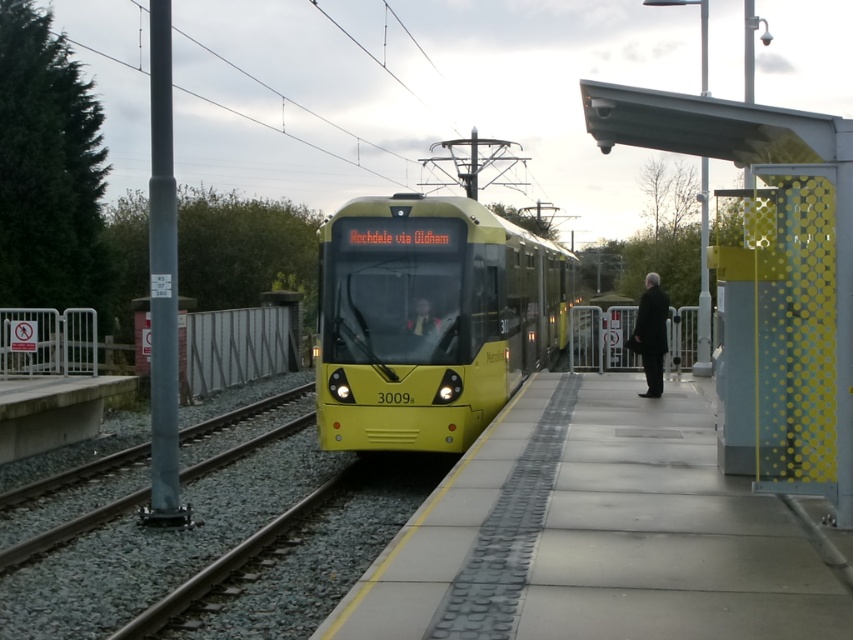
The height and width of the screenshot is (640, 853). I want to click on smooth concrete platform at center, so click(x=595, y=532).

Can you confirm if smooth concrete platform at center is positioned below yellow metallic train at center?

Correct, smooth concrete platform at center is located below yellow metallic train at center.

I want to click on smooth concrete platform at center, so click(x=595, y=532).

Identify the location of smooth concrete platform at center. This screenshot has width=853, height=640. (595, 532).

Is yellow metallic train at center below black wool coat at right?

Incorrect, yellow metallic train at center is not positioned below black wool coat at right.

From the picture: Does yellow metallic train at center have a lesser height compared to black wool coat at right?

No, yellow metallic train at center is not shorter than black wool coat at right.

At what (x,y) coordinates should I click in order to perform the action: click on yellow metallic train at center. Please return your answer as a coordinate pair (x, y). Looking at the image, I should click on (428, 320).

Locate an element on the screen. yellow metallic train at center is located at coordinates coord(428,320).

Is smooth concrete platform at center closer to the viewer compared to black wool coat at right?

Yes, smooth concrete platform at center is in front of black wool coat at right.

Is smooth concrete platform at center further to the viewer compared to black wool coat at right?

That is False.

Where is `smooth concrete platform at center`? smooth concrete platform at center is located at coordinates (595, 532).

At what (x,y) coordinates should I click in order to perform the action: click on smooth concrete platform at center. Please return your answer as a coordinate pair (x, y). The image size is (853, 640). Looking at the image, I should click on (595, 532).